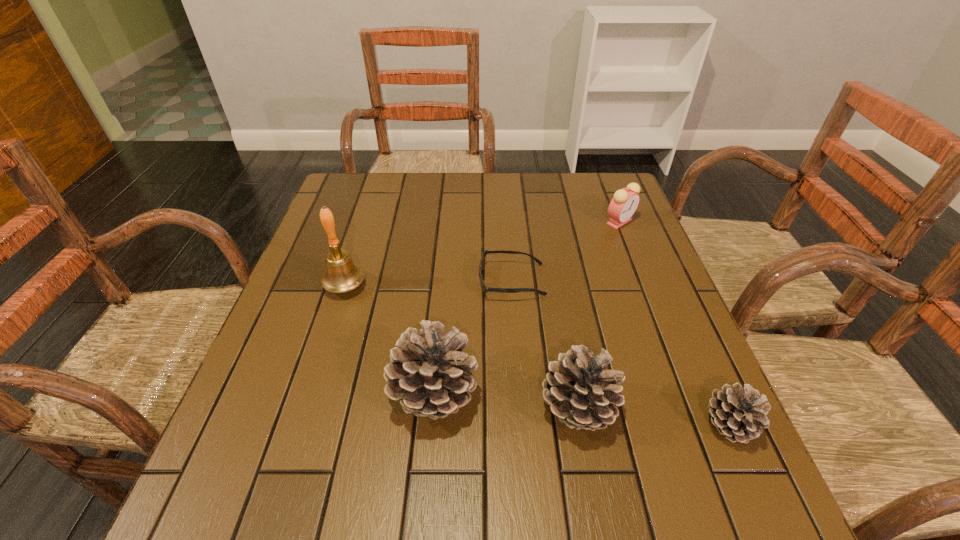
In the current image, all pinecones are evenly spaced. To maintain this equal spacing, where should an additional pinecone be placed on the left? Please point out a free spot. Please provide its 2D coordinates. Your answer should be formatted as a tuple, i.e. [(x, y)], where the tuple contains the x and y coordinates of a point satisfying the conditions above.

[(298, 381)]